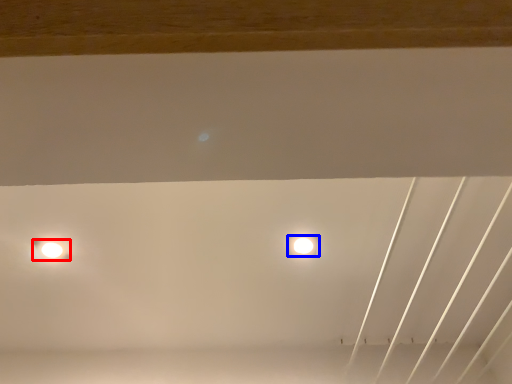
Question: Which object appears closest to the camera in this image, lamp (highlighted by a red box) or lamp (highlighted by a blue box)?

Choices:
 (A) lamp
 (B) lamp

Answer: (A)